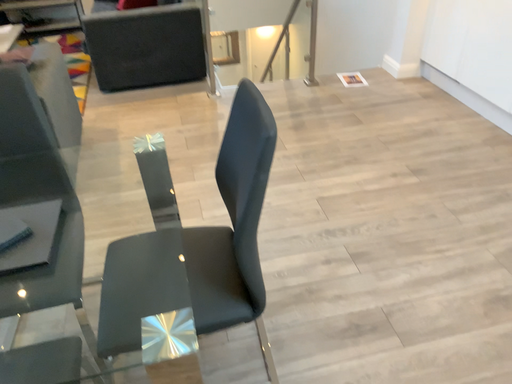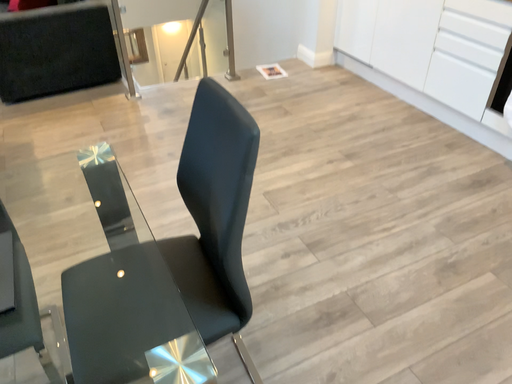
Question: How did the camera likely rotate when shooting the video?

Choices:
 (A) rotated right
 (B) rotated left

Answer: (A)